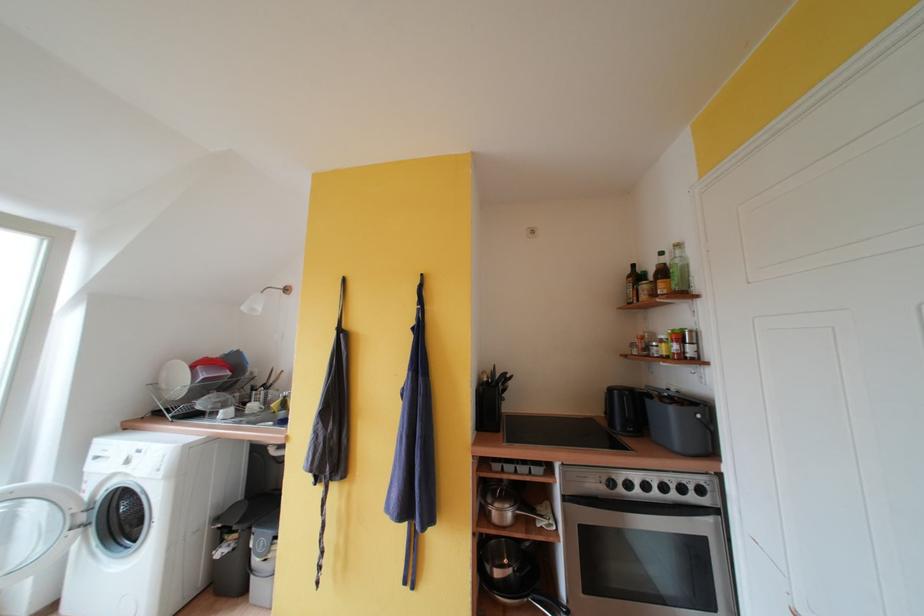
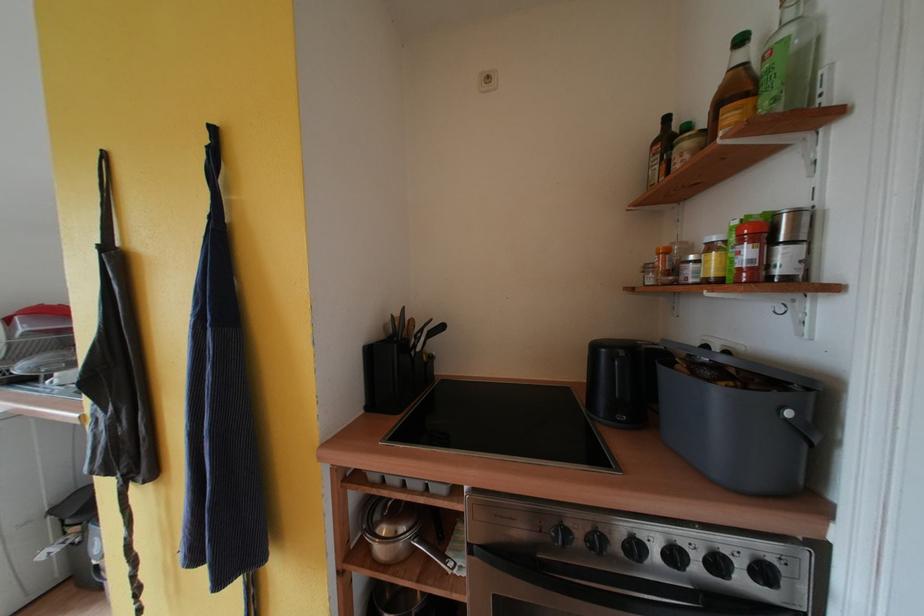
Where in the second image is the point corresponding to (513,377) from the first image?

(436, 323)